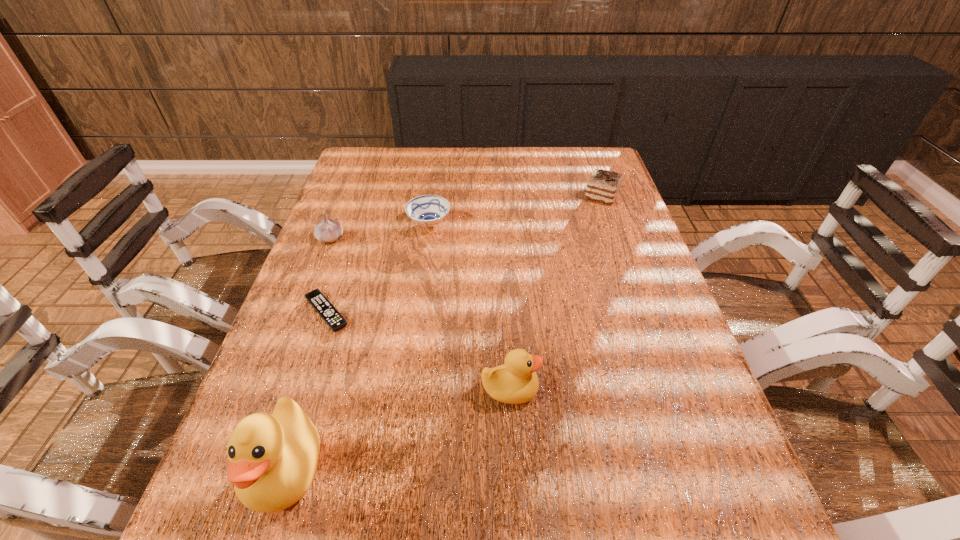
The height and width of the screenshot is (540, 960). I want to click on blank region between the garlic and the rightmost object, so click(x=467, y=217).

The image size is (960, 540). Find the location of `free point between the garlic and the farthest object`. free point between the garlic and the farthest object is located at coordinates (467, 217).

Identify the location of vacant region between the remote control and the garlic. The width and height of the screenshot is (960, 540). [x=328, y=275].

In order to click on free area in between the remote control and the left duck in this screenshot , I will do `click(307, 390)`.

Identify the location of free space between the fourth farthest object and the garlic. (328, 275).

I want to click on vacant space that is in between the garlic and the farthest object, so click(x=467, y=217).

The height and width of the screenshot is (540, 960). Find the location of `object that is the second closest to the shortest object`. object that is the second closest to the shortest object is located at coordinates (272, 459).

Point out which object is positioned as the second nearest to the garlic. Please provide its 2D coordinates. Your answer should be formatted as a tuple, i.e. [(x, y)], where the tuple contains the x and y coordinates of a point satisfying the conditions above.

[(316, 298)]

This screenshot has width=960, height=540. In order to click on free spot that satisfies the following two spatial constraints: 1. on the front side of the farthest object; 2. at the beak of the second tallest object in this screenshot , I will do `click(670, 390)`.

What are the coordinates of `free space that satisfies the following two spatial constraints: 1. at the beak of the second object from right to left; 2. at the beak of the left duck` in the screenshot? It's located at (515, 468).